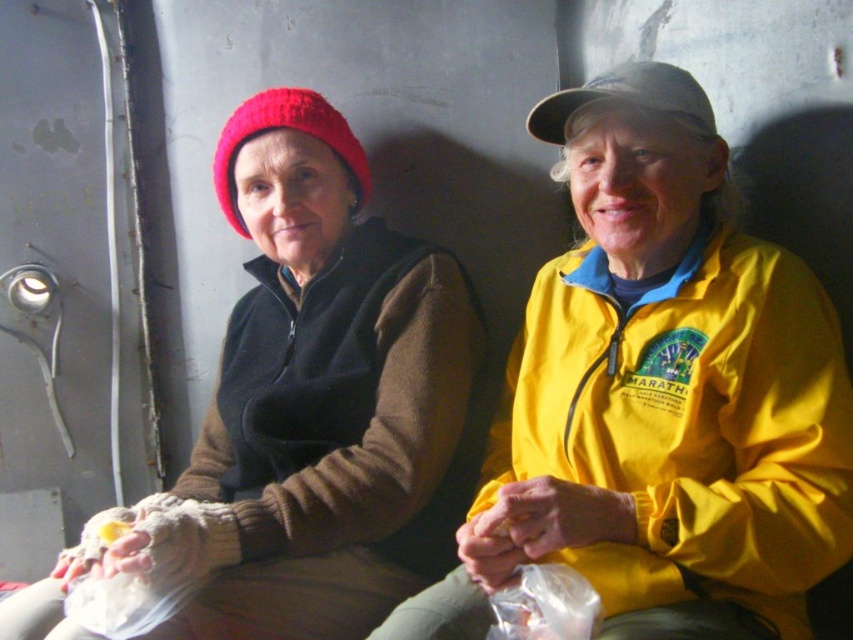
You are trying to determine the spatial relationship between the knitted red beanie at upper left and the transparent plastic bag at lower center. Based on the scene, which object is positioned to the left of the other?

The knitted red beanie at upper left is to the left of transparent plastic bag at lower center.

You are a photographer trying to capture a closeup of both the knitted red beanie at upper left and the knitted woolen beanie at upper left. Since you want both beanies to appear equally prominent in the photo, which adjustment should you make based on their sizes?

The knitted red beanie at upper left is taller than the knitted woolen beanie at upper left. To make both appear equally prominent, you should position the camera closer to the knitted woolen beeanie at upper left so that its size in the frame matches the knitted red beanie at upper left.